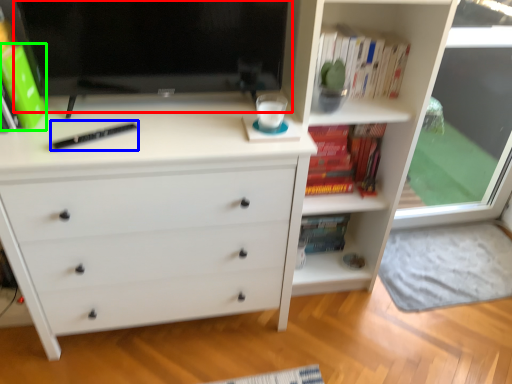
Question: Estimate the real-world distances between objects in this image. Which object is closer to computer monitor (highlighted by a red box), hardback book (highlighted by a blue box) or paperback book (highlighted by a green box)?

Choices:
 (A) hardback book
 (B) paperback book

Answer: (A)